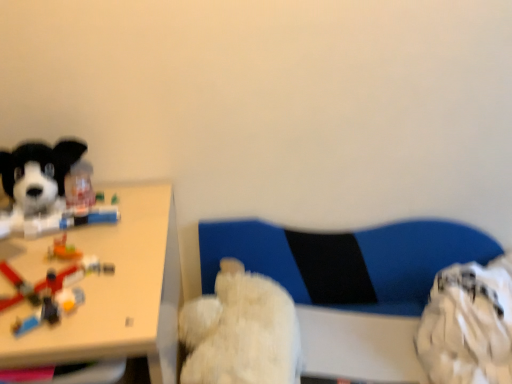
Find the location of `free space that is in between translucent plastic toy at left and soft plush dog at left, the 1th dog when ordered from left to right`. free space that is in between translucent plastic toy at left and soft plush dog at left, the 1th dog when ordered from left to right is located at coordinates (69, 235).